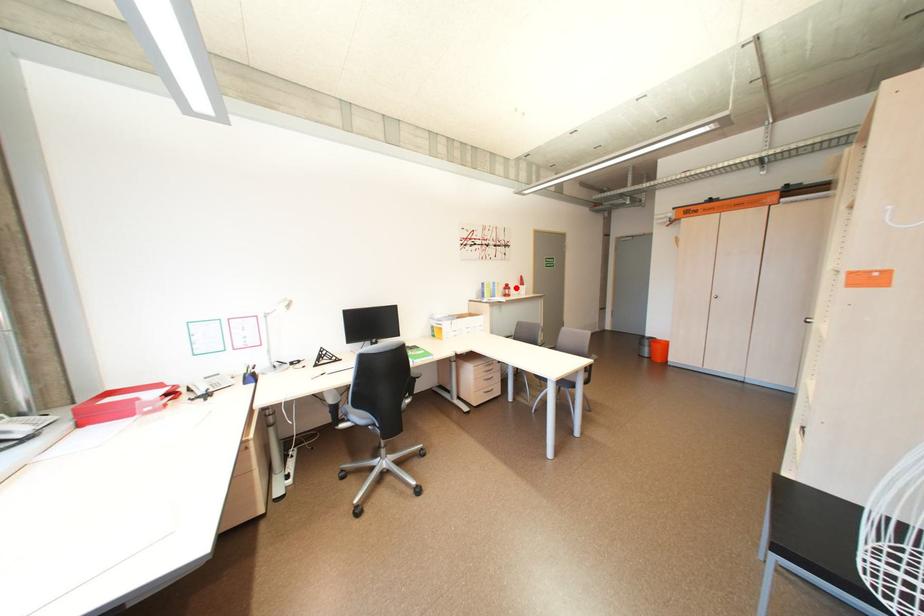
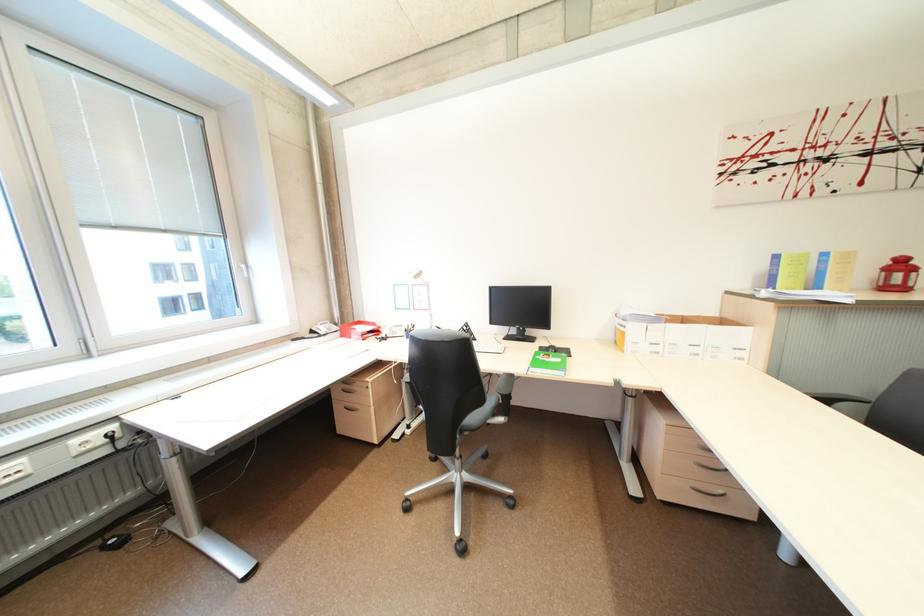
The point at the highlighted location is marked in the first image. Where is the corresponding point in the second image?

(910, 265)